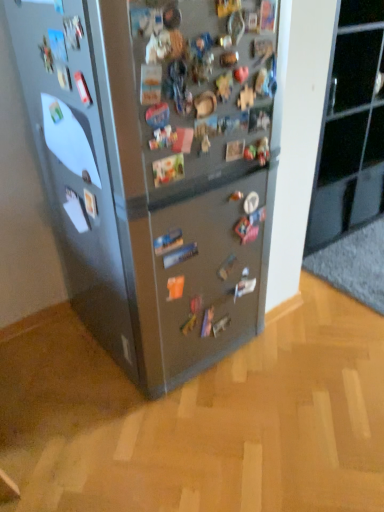
Identify the location of vacant area that is in front of satin silver fridge at center. (165, 442).